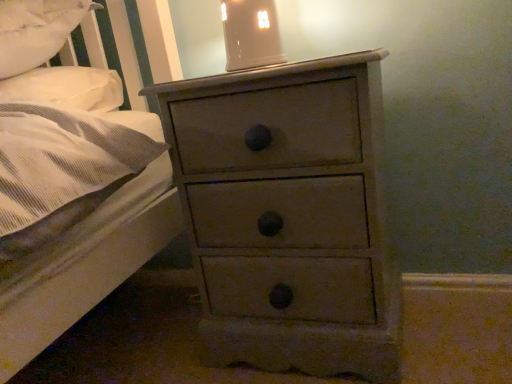
Question: Would you say white soft pillow at upper left is part of matte ceramic lampshade at upper center's contents?

Choices:
 (A) no
 (B) yes

Answer: (A)

Question: Is matte ceramic lampshade at upper center positioned behind white soft pillow at upper left?

Choices:
 (A) no
 (B) yes

Answer: (B)

Question: Is matte ceramic lampshade at upper center completely or partially outside of white soft pillow at upper left?

Choices:
 (A) yes
 (B) no

Answer: (A)

Question: Can you confirm if matte ceramic lampshade at upper center is wider than white soft pillow at upper left?

Choices:
 (A) no
 (B) yes

Answer: (A)

Question: Is matte ceramic lampshade at upper center facing away from white soft pillow at upper left?

Choices:
 (A) no
 (B) yes

Answer: (A)

Question: From a real-world perspective, is distressed gray chest of drawers at center physically located above or below matte ceramic lampshade at upper center?

Choices:
 (A) below
 (B) above

Answer: (A)

Question: Based on their sizes in the image, would you say distressed gray chest of drawers at center is bigger or smaller than matte ceramic lampshade at upper center?

Choices:
 (A) big
 (B) small

Answer: (A)

Question: From the image's perspective, is distressed gray chest of drawers at center located above or below matte ceramic lampshade at upper center?

Choices:
 (A) above
 (B) below

Answer: (B)

Question: Does point (310, 236) appear closer or farther from the camera than point (249, 64)?

Choices:
 (A) closer
 (B) farther

Answer: (A)

Question: Is matte ceramic lampshade at upper center wider or thinner than distressed gray chest of drawers at center?

Choices:
 (A) thin
 (B) wide

Answer: (A)

Question: From the image's perspective, is matte ceramic lampshade at upper center positioned above or below distressed gray chest of drawers at center?

Choices:
 (A) below
 (B) above

Answer: (B)

Question: Is matte ceramic lampshade at upper center situated inside distressed gray chest of drawers at center or outside?

Choices:
 (A) inside
 (B) outside

Answer: (B)

Question: Looking at the image, does matte ceramic lampshade at upper center seem bigger or smaller compared to distressed gray chest of drawers at center?

Choices:
 (A) small
 (B) big

Answer: (A)

Question: Which is correct: white soft pillow at upper left is inside distressed gray chest of drawers at center, or outside of it?

Choices:
 (A) outside
 (B) inside

Answer: (A)

Question: Considering the positions of white soft pillow at upper left and distressed gray chest of drawers at center in the image, is white soft pillow at upper left taller or shorter than distressed gray chest of drawers at center?

Choices:
 (A) tall
 (B) short

Answer: (B)